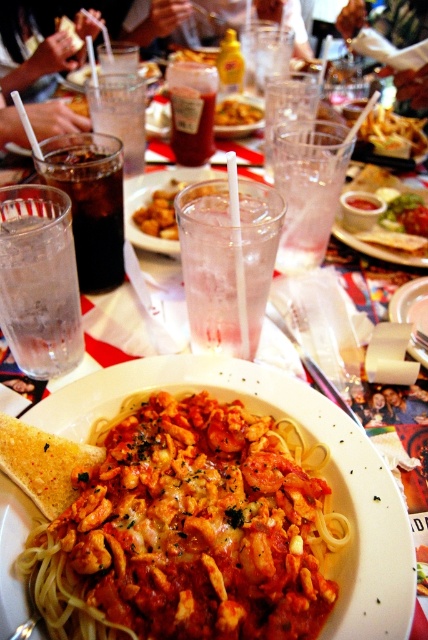
Between dark brown leather jacket at upper center and shiny tomato sauce at center, which one has more height?

Standing taller between the two is dark brown leather jacket at upper center.

Can you confirm if dark brown leather jacket at upper center is positioned below shiny tomato sauce at center?

Actually, dark brown leather jacket at upper center is above shiny tomato sauce at center.

Is point (400, 19) more distant than point (232, 109)?

That is True.

Identify the location of dark brown leather jacket at upper center. The width and height of the screenshot is (428, 640). point(403,20).

Does dark brown leather jacket at upper center have a greater width compared to translucent glass at center?

Yes, dark brown leather jacket at upper center is wider than translucent glass at center.

Between dark brown leather jacket at upper center and translucent glass at center, which one is positioned higher?

Positioned higher is dark brown leather jacket at upper center.

Is point (404, 36) less distant than point (195, 157)?

No, it is behind (195, 157).

Locate an element on the screen. dark brown leather jacket at upper center is located at coordinates (403, 20).

Is shiny tomato sauce pasta at center shorter than clear glass at center?

Indeed, shiny tomato sauce pasta at center has a lesser height compared to clear glass at center.

Is shiny tomato sauce pasta at center to the left of clear glass at center from the viewer's perspective?

Yes, shiny tomato sauce pasta at center is to the left of clear glass at center.

The width and height of the screenshot is (428, 640). Describe the element at coordinates (190, 531) in the screenshot. I see `shiny tomato sauce pasta at center` at that location.

Locate an element on the screen. shiny tomato sauce pasta at center is located at coordinates (190, 531).